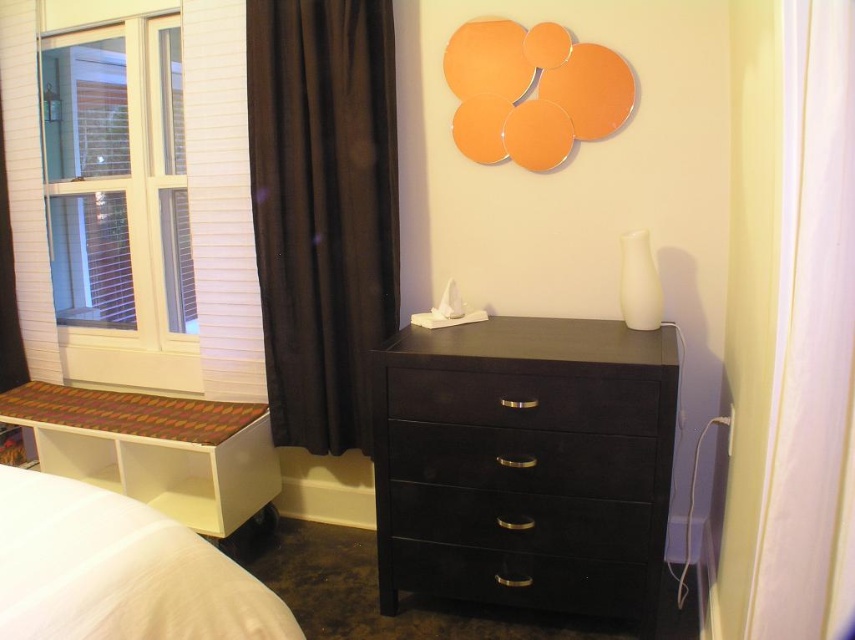
Question: Which is nearer to the matte black dresser at center?

Choices:
 (A) brown velvet curtain at left
 (B) white soft bed at lower left
 (C) white glass window at left
 (D) black matte drawer at center

Answer: (D)

Question: Which is farther from the black velvet drawer at center?

Choices:
 (A) black glossy drawer at lower center
 (B) brown velvet curtain at left

Answer: (B)

Question: Can you confirm if black velvet drawer at center is wider than black glossy drawer at lower center?

Choices:
 (A) yes
 (B) no

Answer: (B)

Question: Which object is positioned farthest from the black matte drawer at center?

Choices:
 (A) white glass window at left
 (B) brown velvet curtain at left

Answer: (A)

Question: Can you confirm if brown velvet curtain at left is thinner than white glass window at left?

Choices:
 (A) no
 (B) yes

Answer: (B)

Question: Is matte black dresser at center in front of brown velvet curtain at left?

Choices:
 (A) yes
 (B) no

Answer: (A)